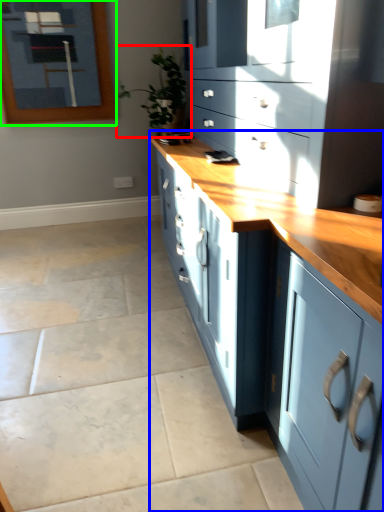
Question: Based on their relative distances, which object is nearer to houseplant (highlighted by a red box)? Choose from cabinetry (highlighted by a blue box) and picture frame (highlighted by a green box).

Choices:
 (A) cabinetry
 (B) picture frame

Answer: (B)